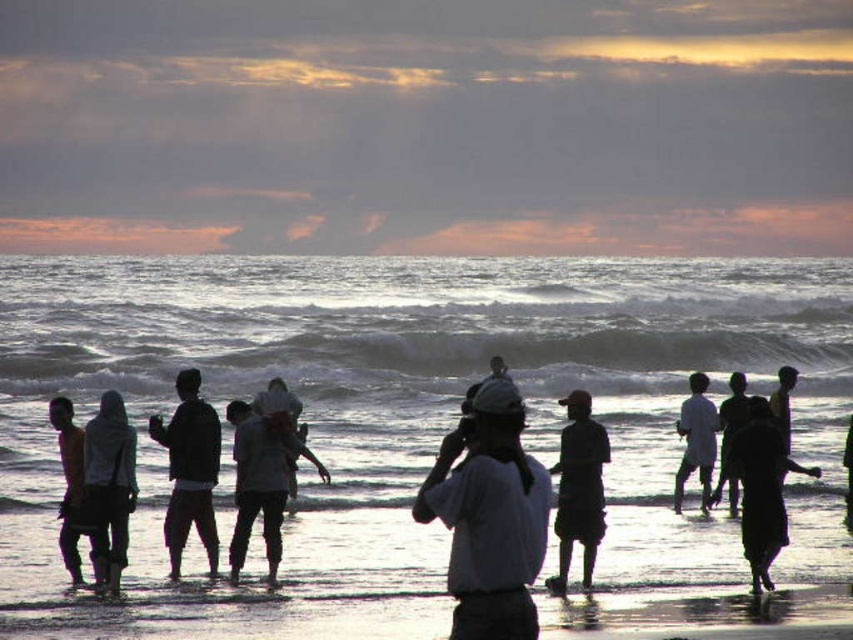
Question: Can you confirm if dark skin human at center is bigger than white fabric shirt at center?

Choices:
 (A) yes
 (B) no

Answer: (A)

Question: Among these objects, which one is farthest from the camera?

Choices:
 (A) dark skin human at center
 (B) white fabric shirt at center
 (C) dark matte clothing at center
 (D) black fabric dress at lower right

Answer: (B)

Question: Which point is farther from the camera taking this photo?

Choices:
 (A) (354, 362)
 (B) (234, 403)
 (C) (809, 468)

Answer: (A)

Question: Is white fabric headscarf at center below white cotton shirt at center?

Choices:
 (A) yes
 (B) no

Answer: (A)

Question: Among these objects, which one is farthest from the camera?

Choices:
 (A) white fabric shirt at center
 (B) white fabric headscarf at center

Answer: (A)

Question: In this image, where is dark matte clothing at center located relative to dark gray fabric cap at center?

Choices:
 (A) below
 (B) above

Answer: (B)